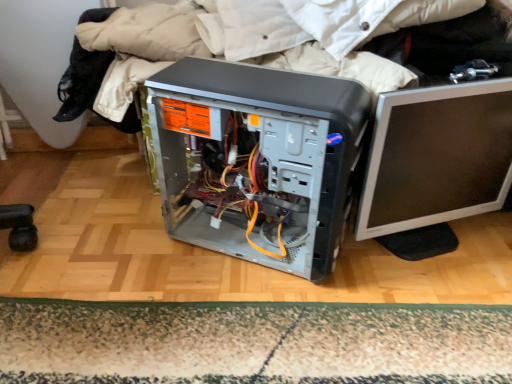
This screenshot has width=512, height=384. I want to click on free spot above carpeted mat at lower center (from a real-world perspective), so click(x=249, y=332).